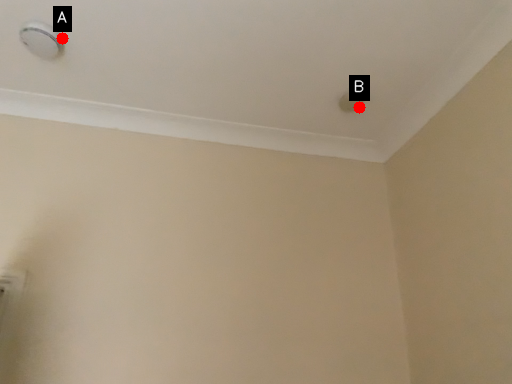
Question: Two points are circled on the image, labeled by A and B beside each circle. Which of the following is the closest to the observer?

Choices:
 (A) A is closer
 (B) B is closer

Answer: (A)